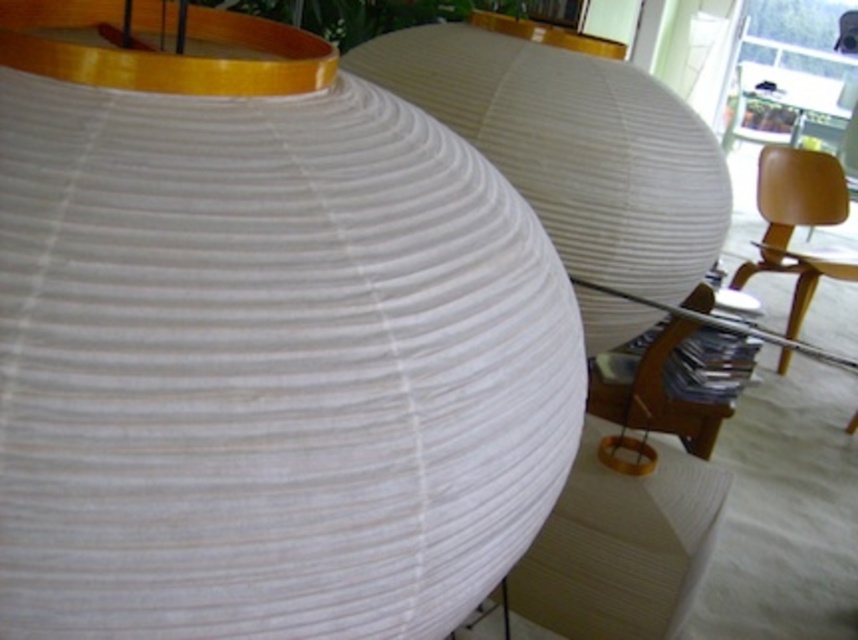
You are standing in a room and want to place a 3.5 meter long ladder between the white paper lantern at center and the matte yellow chair at right. Is there enough space for the ladder to fit horizontally between them?

The white paper lantern at center and matte yellow chair at right are 4.23 meters apart from each other, so yes, the ladder can fit horizontally between them as the distance is greater than the ladder length.

You are standing in a room and see the white ribbed paper lantern at center and the matte yellow chair at right. Which object is nearer to you?

The white ribbed paper lantern at center is closer to the viewer than the matte yellow chair at right.

You are organizing a small event and need to place a 1.2 meter wide table between the white paper lantern at center and the matte yellow chair at right. Can the table fit between them based on their widths?

The white paper lantern at center is narrower than the matte yellow chair at right. However, the table requires 1.2 meters of space, but the description only provides information about their widths relative to each other, not their absolute measurements. Therefore, it is impossible to determine if the table will fit based on the given information.